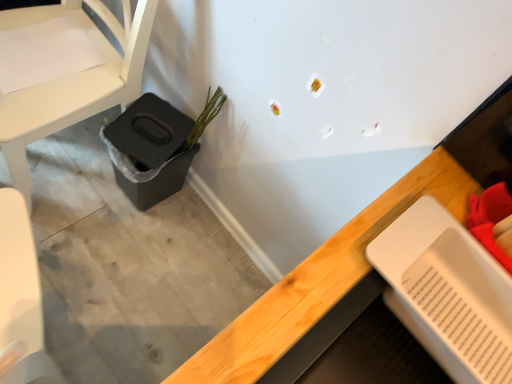
Question: Is the position of green matte plant at lower left less distant than that of white plastic tray at lower right?

Choices:
 (A) no
 (B) yes

Answer: (A)

Question: From the image's perspective, is green matte plant at lower left on white plastic tray at lower right?

Choices:
 (A) no
 (B) yes

Answer: (B)

Question: Is green matte plant at lower left aimed at white plastic tray at lower right?

Choices:
 (A) no
 (B) yes

Answer: (A)

Question: From the image's perspective, is green matte plant at lower left located beneath white plastic tray at lower right?

Choices:
 (A) no
 (B) yes

Answer: (A)

Question: Is white plastic tray at lower right at the back of green matte plant at lower left?

Choices:
 (A) no
 (B) yes

Answer: (A)

Question: Does green matte plant at lower left have a greater width compared to white plastic tray at lower right?

Choices:
 (A) yes
 (B) no

Answer: (B)

Question: From a real-world perspective, is green matte plant at lower left located beneath black plastic potty at lower left?

Choices:
 (A) no
 (B) yes

Answer: (A)

Question: Considering the relative sizes of green matte plant at lower left and black plastic potty at lower left in the image provided, is green matte plant at lower left wider than black plastic potty at lower left?

Choices:
 (A) no
 (B) yes

Answer: (A)

Question: Can you confirm if green matte plant at lower left is positioned to the left of black plastic potty at lower left?

Choices:
 (A) yes
 (B) no

Answer: (B)

Question: Is green matte plant at lower left beside black plastic potty at lower left?

Choices:
 (A) yes
 (B) no

Answer: (B)

Question: From the image's perspective, is green matte plant at lower left above black plastic potty at lower left?

Choices:
 (A) no
 (B) yes

Answer: (B)

Question: Is green matte plant at lower left aimed at black plastic potty at lower left?

Choices:
 (A) yes
 (B) no

Answer: (B)

Question: From a real-world perspective, is black plastic potty at lower left below white matte chair at left?

Choices:
 (A) no
 (B) yes

Answer: (B)